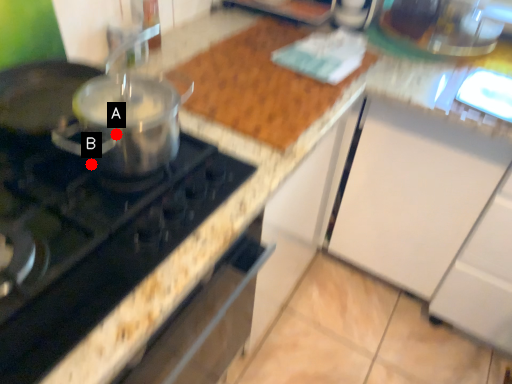
Question: Two points are circled on the image, labeled by A and B beside each circle. Which point is farther to the camera?

Choices:
 (A) A is further
 (B) B is further

Answer: (B)